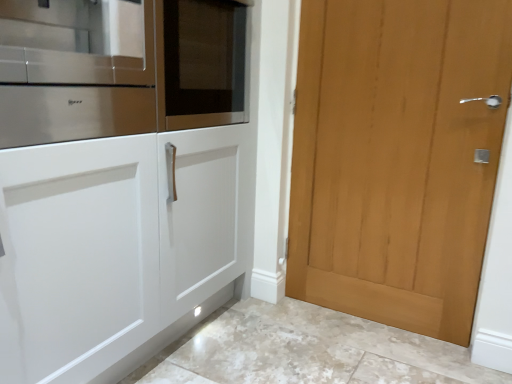
Image resolution: width=512 pixels, height=384 pixels. In order to click on vacant space underneath light brown wood door at right (from a real-world perspective) in this screenshot , I will do `click(365, 323)`.